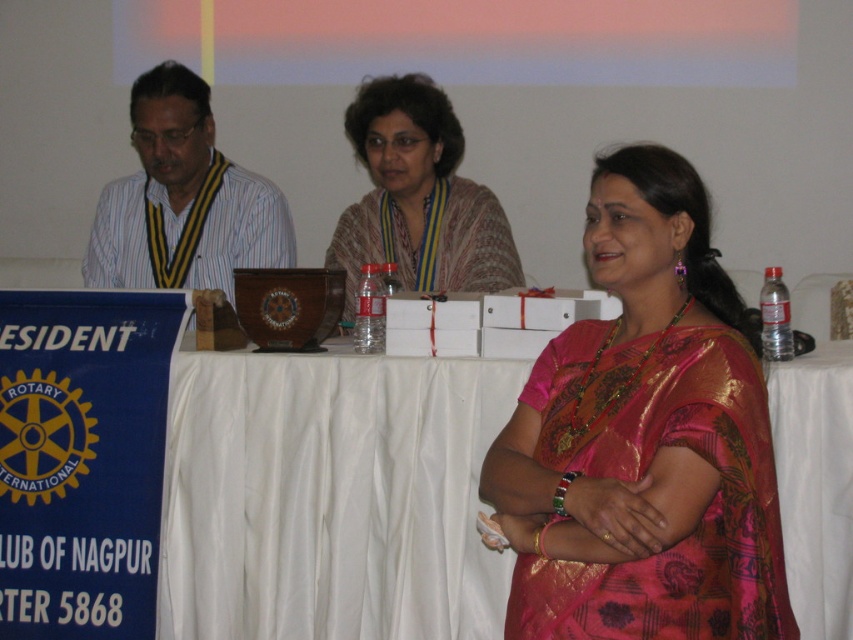
From the picture: Does white cloth at center have a greater width compared to striped shirt at left?

Correct, the width of white cloth at center exceeds that of striped shirt at left.

Who is higher up, white cloth at center or striped shirt at left?

striped shirt at left is higher up.

Identify the location of white cloth at center. pyautogui.click(x=329, y=497).

Image resolution: width=853 pixels, height=640 pixels. I want to click on white cloth at center, so click(329, 497).

Does pink silk saree at center come behind patterned fabric shawl at center?

No.

I want to click on pink silk saree at center, so click(643, 438).

Does pink silk saree at center appear on the left side of striped shirt at left?

In fact, pink silk saree at center is to the right of striped shirt at left.

Does point (669, 560) come in front of point (184, 140)?

That is True.

At what (x,y) coordinates should I click in order to perform the action: click on pink silk saree at center. Please return your answer as a coordinate pair (x, y). Image resolution: width=853 pixels, height=640 pixels. Looking at the image, I should click on click(x=643, y=438).